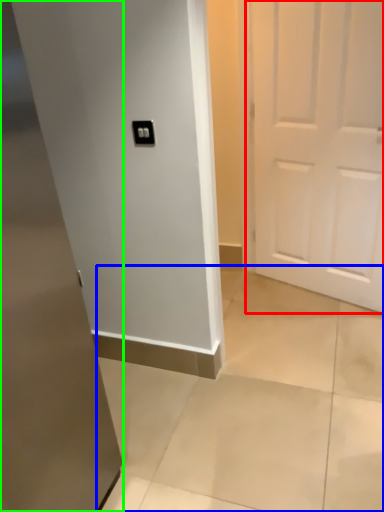
Question: Which is farther away from door (highlighted by a red box)? concrete (highlighted by a blue box) or door (highlighted by a green box)?

Choices:
 (A) concrete
 (B) door

Answer: (B)